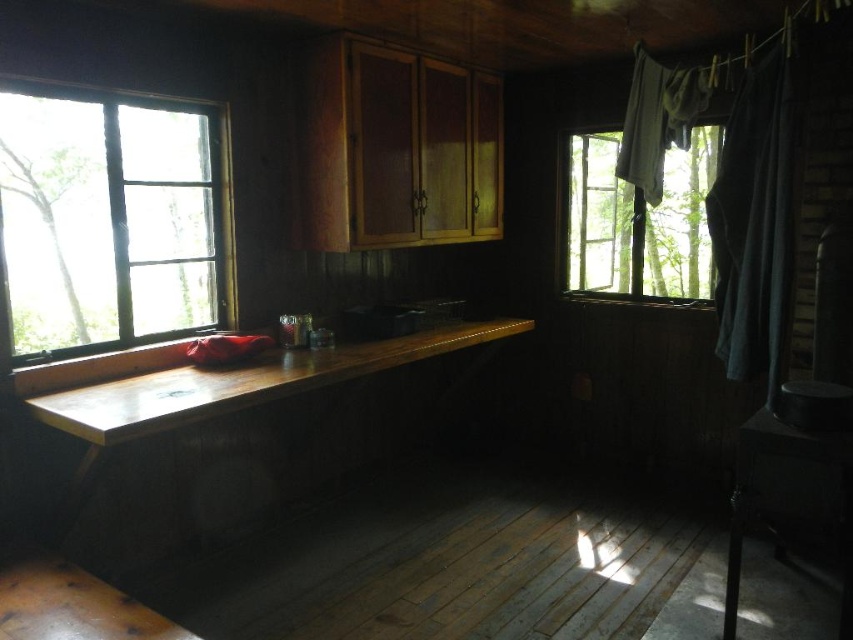
Question: In this image, where is clear glass window at left located relative to transparent glass window at upper right?

Choices:
 (A) above
 (B) below

Answer: (B)

Question: Which is nearer to the clear glass window at left?

Choices:
 (A) gray fabric curtain at right
 (B) transparent glass window at upper right

Answer: (A)

Question: Based on their relative distances, which object is farther from the transparent glass window at upper right?

Choices:
 (A) clear glass window at left
 (B) gray fabric curtain at right

Answer: (A)

Question: Estimate the real-world distances between objects in this image. Which object is closer to the clear glass window at left?

Choices:
 (A) gray fabric curtain at right
 (B) transparent glass window at upper right

Answer: (A)

Question: In this image, where is clear glass window at left located relative to transparent glass window at upper right?

Choices:
 (A) below
 (B) above

Answer: (A)

Question: Observing the image, what is the correct spatial positioning of clear glass window at left in reference to gray fabric curtain at right?

Choices:
 (A) left
 (B) right

Answer: (A)